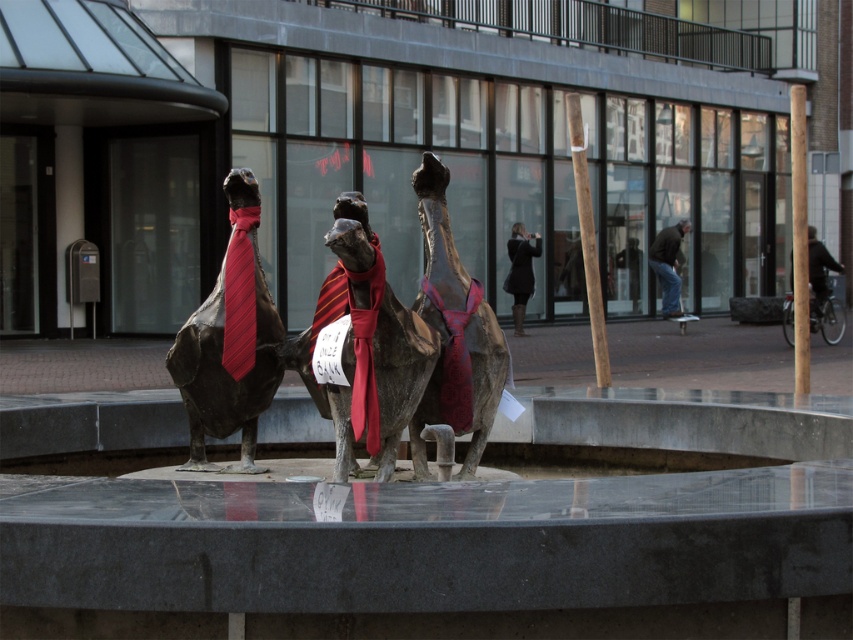
Question: Is shiny bronze statue at center below polished bronze camel at center?

Choices:
 (A) no
 (B) yes

Answer: (B)

Question: Which point is closer to the camera?

Choices:
 (A) shiny bronze camel at center
 (B) dark brown leather jacket at center
 (C) polished bronze camel at center
 (D) shiny bronze statue at center

Answer: (A)

Question: Which of these objects is positioned farthest from the dark brown leather jacket at center?

Choices:
 (A) shiny bronze statue at center
 (B) shiny bronze camel at center

Answer: (B)

Question: Can you confirm if shiny bronze camel at center is bigger than polished bronze camel at center?

Choices:
 (A) no
 (B) yes

Answer: (B)

Question: Is polished bronze camel at center closer to the viewer compared to dark brown leather jacket at center?

Choices:
 (A) no
 (B) yes

Answer: (B)

Question: Which point is farther from the camera taking this photo?

Choices:
 (A) (202, 336)
 (B) (416, 173)
 (C) (675, 275)

Answer: (C)